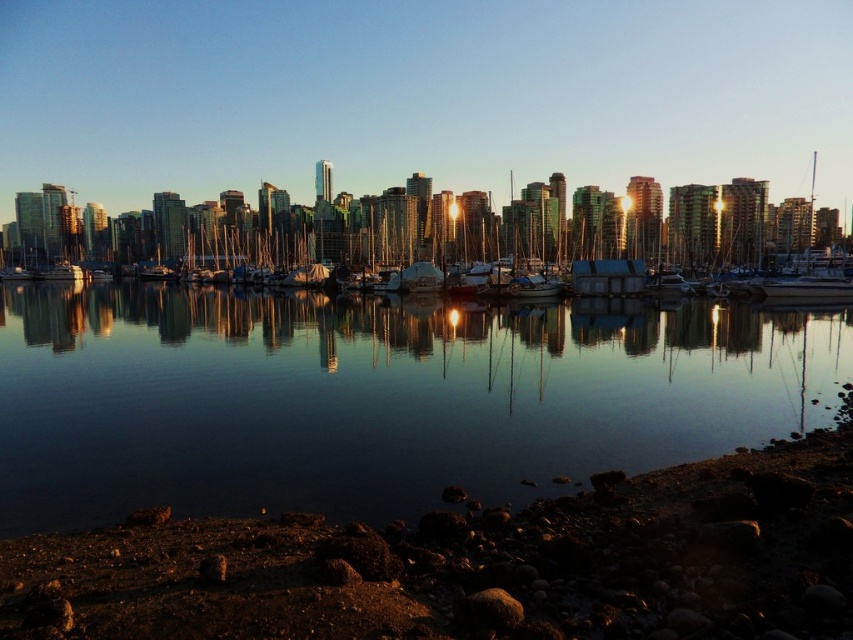
Is transparent glass water at center thinner than metallic silver boat at left?

Incorrect, transparent glass water at center's width is not less than metallic silver boat at left's.

Can you confirm if transparent glass water at center is wider than metallic silver boat at left?

Correct, the width of transparent glass water at center exceeds that of metallic silver boat at left.

Is point (524, 353) farther from camera compared to point (79, 272)?

No, (524, 353) is in front of (79, 272).

The width and height of the screenshot is (853, 640). Identify the location of transparent glass water at center. (375, 397).

Is point (666, 474) positioned before point (726, 227)?

Yes, it is.

Between point (637, 506) and point (262, 272), which one is positioned behind?

The point (262, 272) is behind.

Who is more distant from viewer, (x=619, y=536) or (x=96, y=225)?

Positioned behind is point (x=96, y=225).

Identify the location of rough stone shore at lower right. The height and width of the screenshot is (640, 853). (479, 566).

Describe the element at coordinates (375, 397) in the screenshot. The height and width of the screenshot is (640, 853). I see `transparent glass water at center` at that location.

Can you confirm if transparent glass water at center is positioned to the left of metallic silver sailboat at center?

Correct, you'll find transparent glass water at center to the left of metallic silver sailboat at center.

Which is behind, point (386, 500) or point (338, 216)?

The point (338, 216) is behind.

You are a GUI agent. You are given a task and a screenshot of the screen. Output one action in this format:
    pyautogui.click(x=<x>, y=<y>)
    Task: Click on the transparent glass water at center
    This screenshot has height=640, width=853.
    Given the screenshot: What is the action you would take?
    pyautogui.click(x=375, y=397)